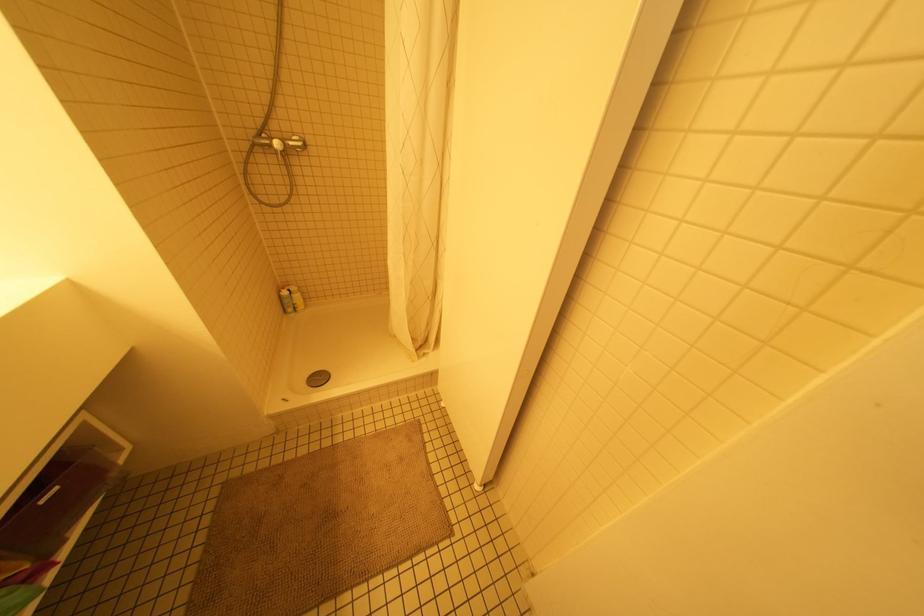
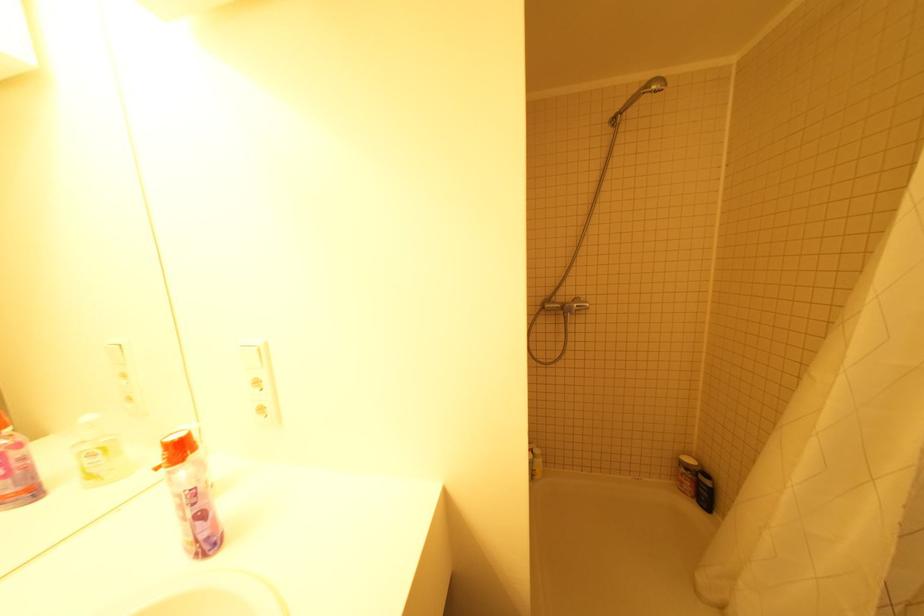
First-person continuous shooting, in which direction is the camera rotating?

The camera rotated toward left-up.